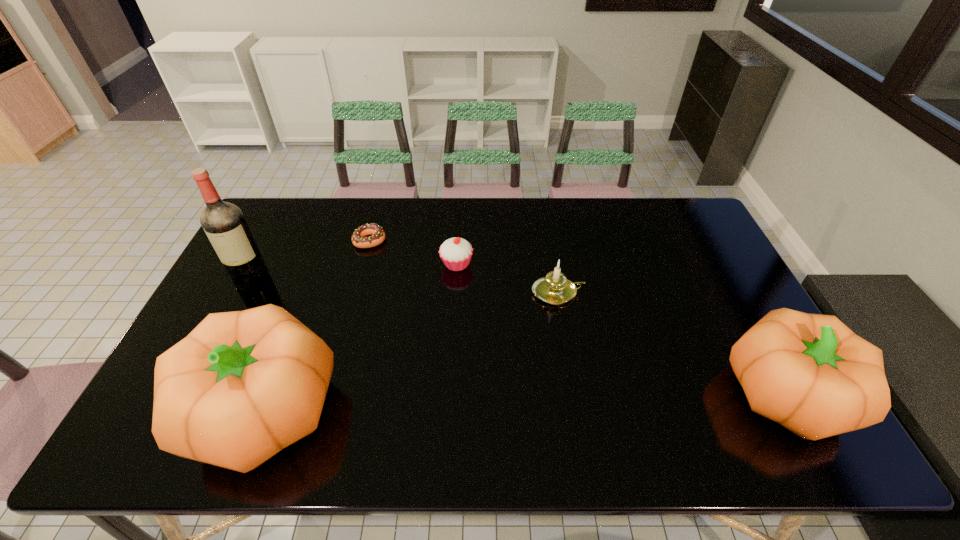
Locate an element on the screen. the third object from right to left is located at coordinates (456, 253).

Identify the location of free space located 0.080m on the carved face of the taller pumpkin. (152, 409).

At what (x,y) coordinates should I click in order to perform the action: click on vacant area situated 0.200m on the handle side of the candle holder. Please return your answer as a coordinate pair (x, y). Looking at the image, I should click on [x=649, y=293].

This screenshot has width=960, height=540. In order to click on vacant region located 0.060m on the front of the shortest object in this screenshot , I will do `click(364, 263)`.

I want to click on vacant space located on the front-facing side of the tallest object, so click(x=206, y=372).

Where is `free spot located 0.190m on the right of the fourth object from left to right`? free spot located 0.190m on the right of the fourth object from left to right is located at coordinates (532, 264).

This screenshot has width=960, height=540. I want to click on object that is at the far edge, so click(x=359, y=240).

You are a GUI agent. You are given a task and a screenshot of the screen. Output one action in this format:
    pyautogui.click(x=<x>, y=<y>)
    Task: Click on the pumpkin that is at the left edge
    
    Given the screenshot: What is the action you would take?
    pyautogui.click(x=243, y=385)

Identify the location of liquor located in the left edge section of the desktop. (224, 224).

Identify the location of object that is positioned at the right edge. The height and width of the screenshot is (540, 960). (810, 373).